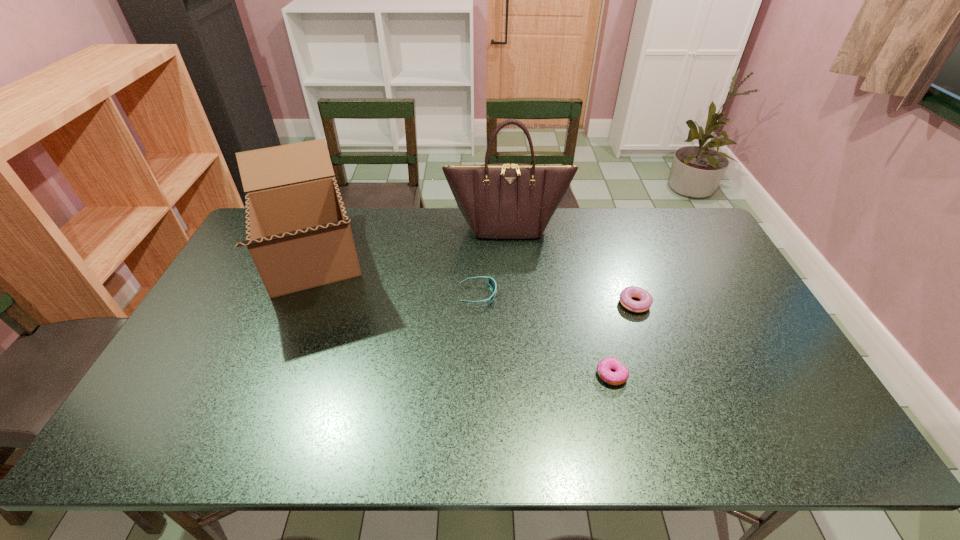
Identify the location of vacant space at the right edge of the desktop. The width and height of the screenshot is (960, 540). (764, 370).

Where is `free location at the near left corner of the desktop`? Image resolution: width=960 pixels, height=540 pixels. free location at the near left corner of the desktop is located at coordinates (134, 423).

Find the location of `free space at the near right corner`. free space at the near right corner is located at coordinates (789, 424).

Identify the location of vacant area that lies between the leftmost object and the nearer doughnut. This screenshot has height=540, width=960. (462, 317).

The width and height of the screenshot is (960, 540). Identify the location of unoccupied area between the left doughnut and the second tallest object. (462, 317).

Locate an element on the screen. empty location between the tallest object and the box is located at coordinates (410, 243).

Find the location of a particular element. The width and height of the screenshot is (960, 540). vacant space in between the rightmost object and the sunglasses is located at coordinates (557, 300).

Locate an element on the screen. free spot between the box and the handbag is located at coordinates (410, 243).

Where is `free space between the farther doughnut and the sunglasses`? The image size is (960, 540). free space between the farther doughnut and the sunglasses is located at coordinates (557, 300).

Identify the location of free space between the farther doughnut and the sunglasses. The width and height of the screenshot is (960, 540). (557, 300).